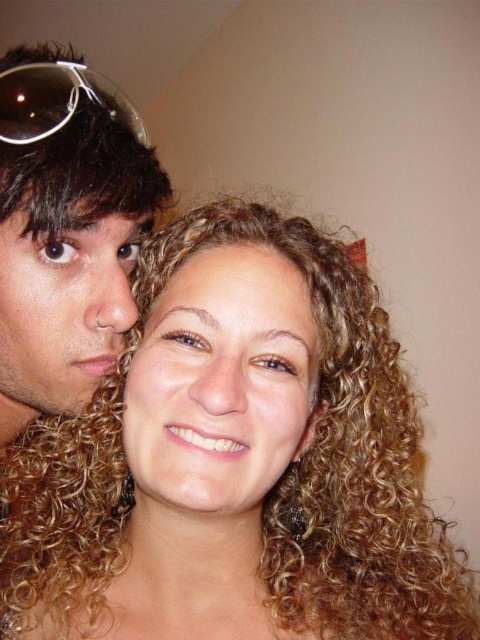
Question: Which point is closer to the camera?

Choices:
 (A) transparent plastic sunglasses at upper left
 (B) matte black hair at left

Answer: (B)

Question: Does curly blonde hair at center appear over golden curly hair at center?

Choices:
 (A) yes
 (B) no

Answer: (B)

Question: Which of the following is the closest to the observer?

Choices:
 (A) golden curly hair at center
 (B) curly blonde hair at center
 (C) matte skin face at left
 (D) matte black hair at left

Answer: (B)

Question: Among these objects, which one is farthest from the camera?

Choices:
 (A) golden curly hair at center
 (B) matte black hair at left
 (C) matte skin face at left

Answer: (C)

Question: Is golden curly hair at center positioned behind transparent plastic sunglasses at upper left?

Choices:
 (A) yes
 (B) no

Answer: (B)

Question: Is golden curly hair at center below transparent plastic sunglasses at upper left?

Choices:
 (A) no
 (B) yes

Answer: (B)